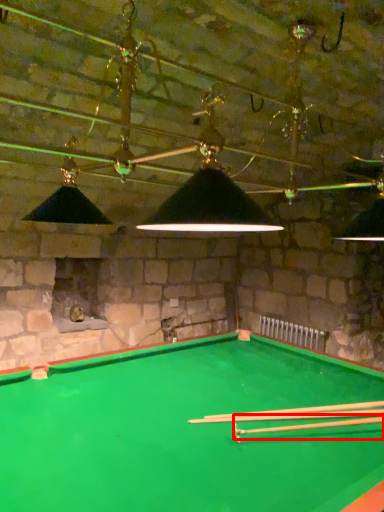
Question: From the image, what is the correct spatial relationship of cue (annotated by the red box) in relation to cue?

Choices:
 (A) right
 (B) left

Answer: (A)